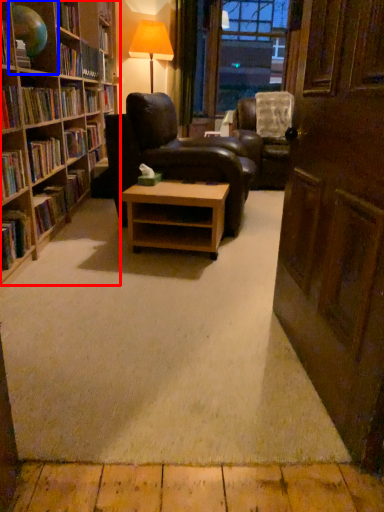
Question: Which point is closer to the camera, bookcase (highlighted by a red box) or shelf (highlighted by a blue box)?

Choices:
 (A) bookcase
 (B) shelf

Answer: (A)